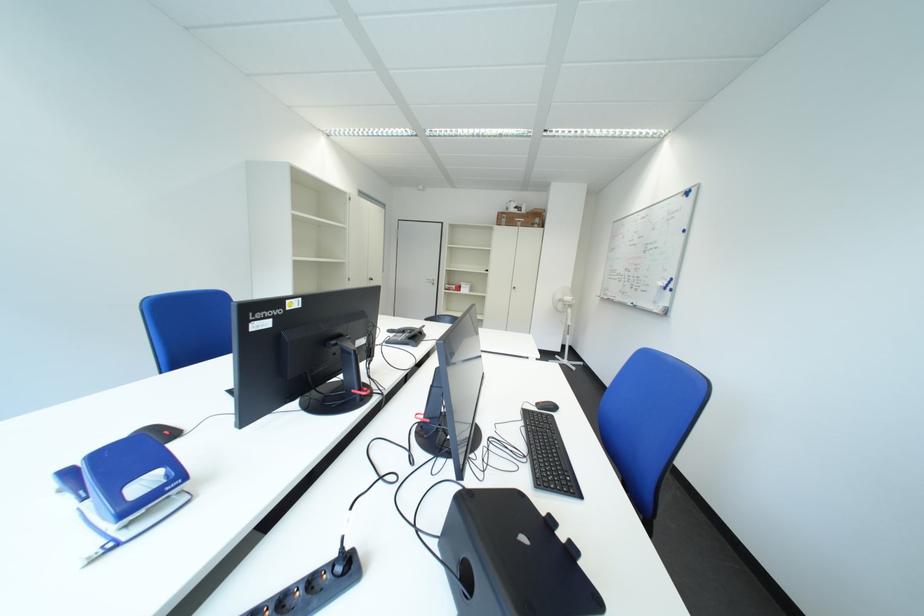
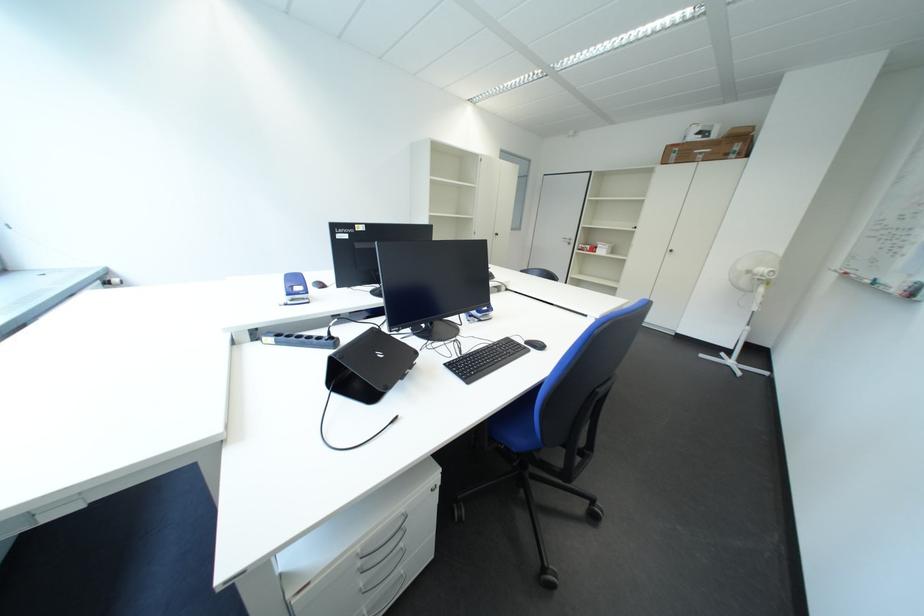
Where in the second image is the point corresponding to point (550, 223) from the first image?

(748, 150)